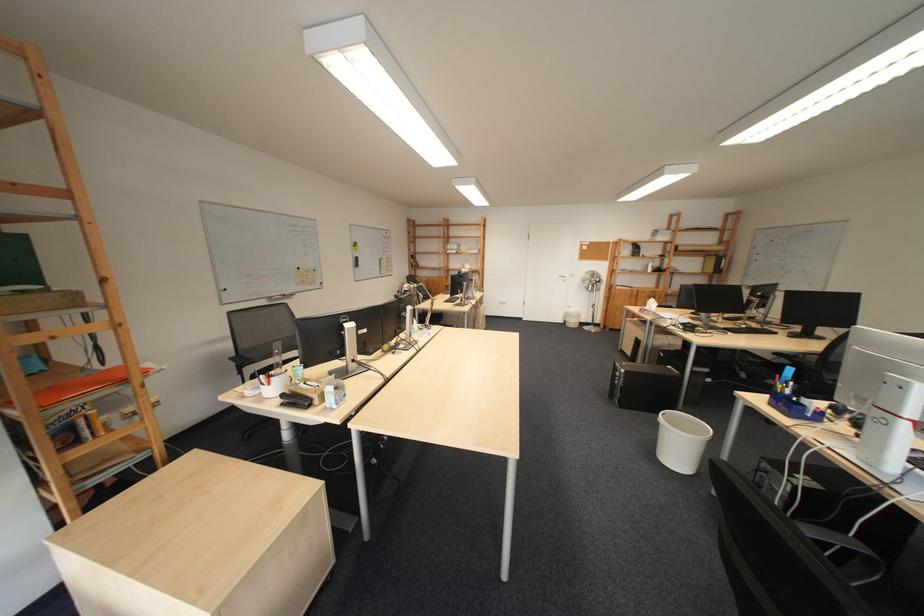
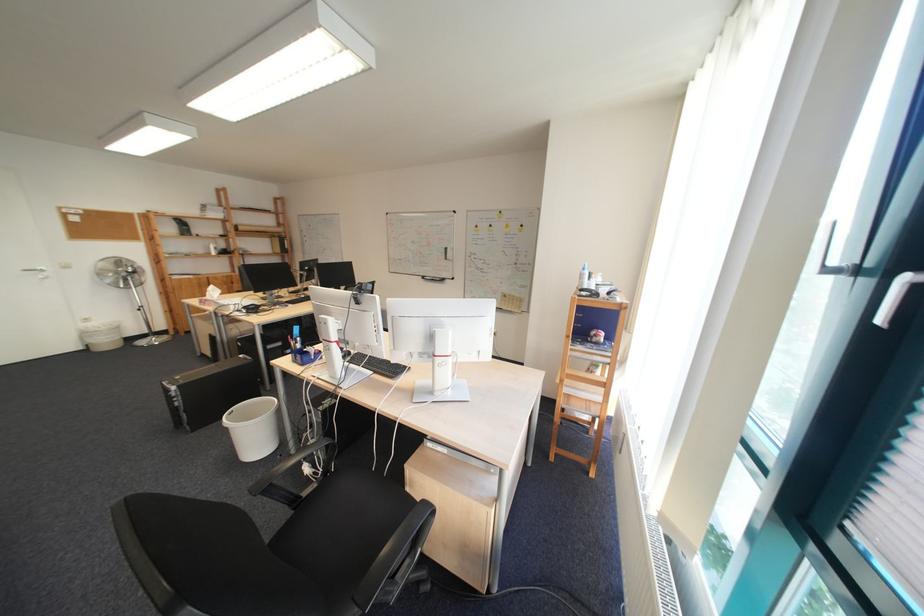
Where in the second image is the point corresponding to the point at 630,378 from the first image?

(188, 399)